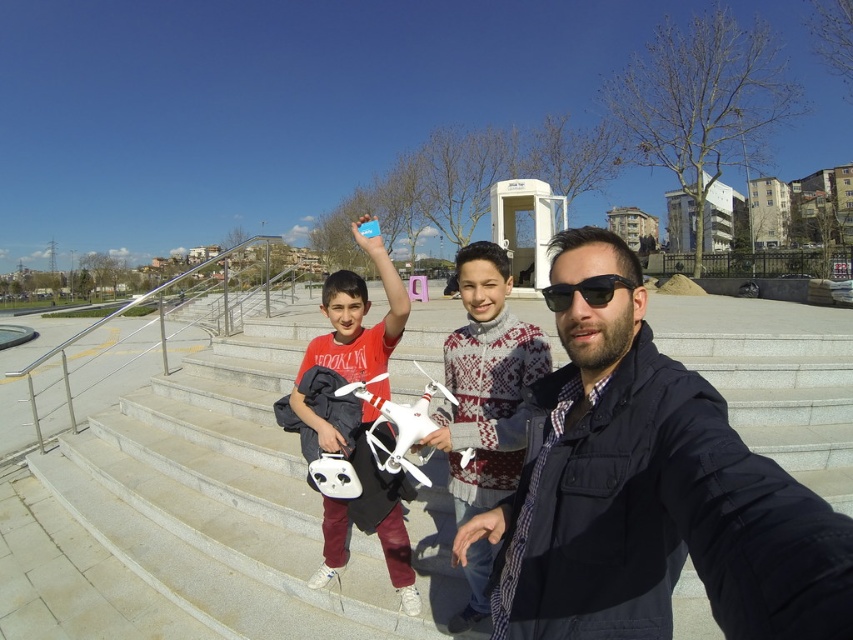
You are a photographer at the park and want to capture a photo of the white knitted sweater at center and the white matte drone at center. Which object is positioned to the right side in the image?

The white knitted sweater at center is positioned to the right of the white matte drone at center.

You are a photographer trying to capture a candid shot of the black plastic sunglasses at center and the white knitted sweater at center. Since you want to focus on both subjects, which one should you adjust your camera focus to prioritize first if you want to ensure both are in frame?

The black plastic sunglasses at center is behind the white knitted sweater at center, so you should focus on the white knitted sweater at center first to ensure both are in frame.